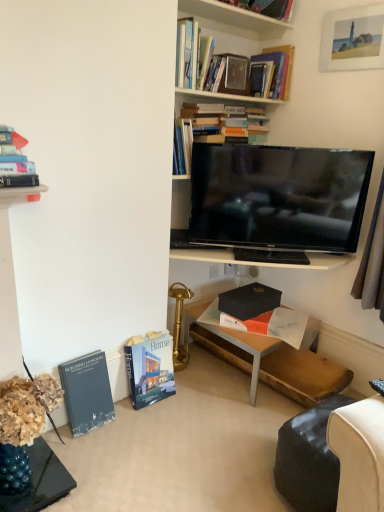
At what (x,y) coordinates should I click in order to perform the action: click on free space in front of matte black table at center. Please return your answer as a coordinate pair (x, y). This screenshot has width=384, height=512. Looking at the image, I should click on (217, 429).